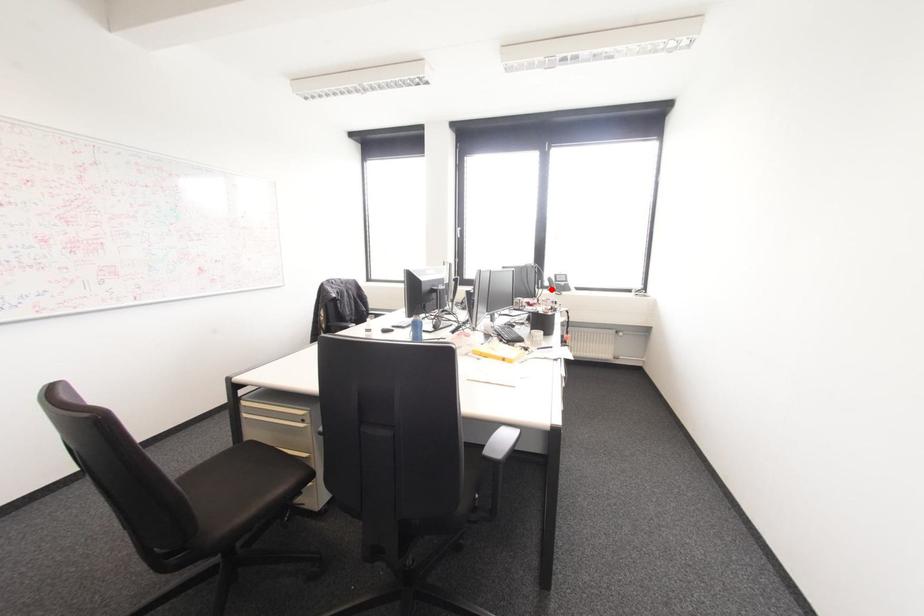
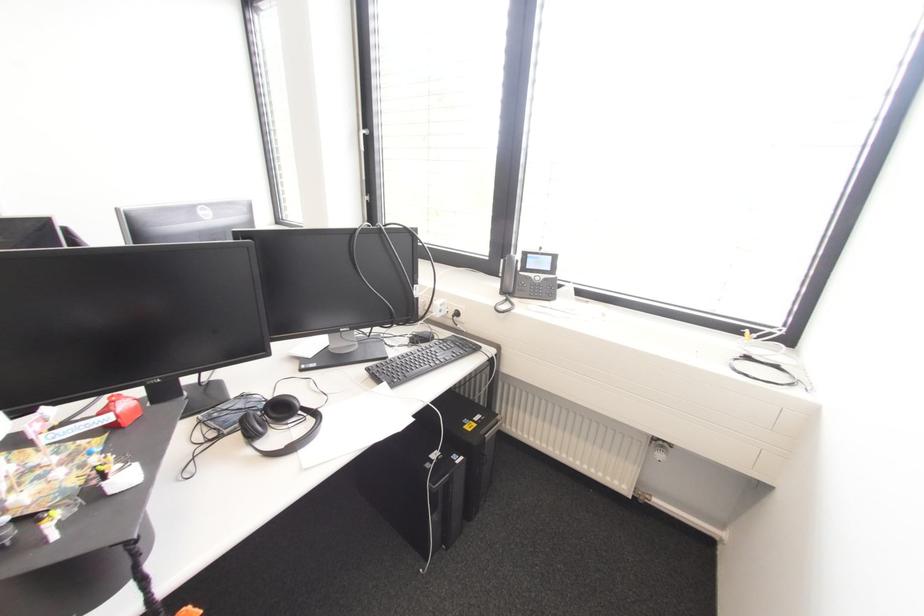
Locate, in the second image, the point that corresponds to the highlighted location in the first image.

(503, 292)